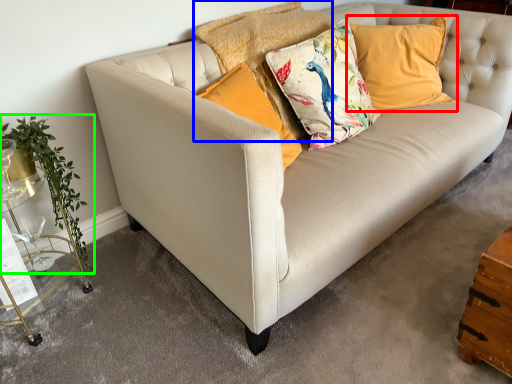
Question: Estimate the real-world distances between objects in this image. Which object is farther from pillow (highlighted by a red box), pillow (highlighted by a blue box) or plant (highlighted by a green box)?

Choices:
 (A) pillow
 (B) plant

Answer: (B)